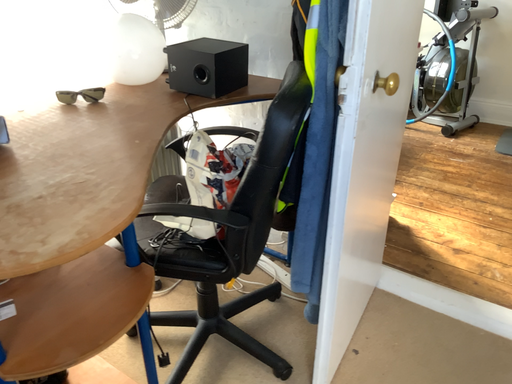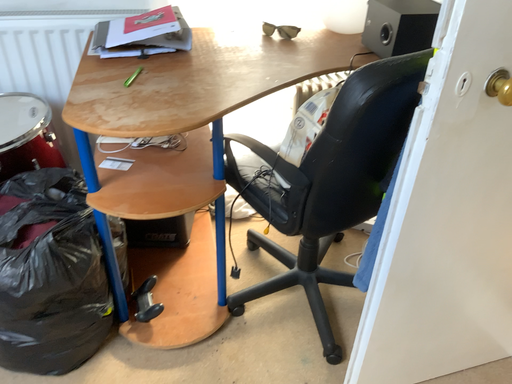
Question: How did the camera likely rotate when shooting the video?

Choices:
 (A) rotated right
 (B) rotated left

Answer: (B)